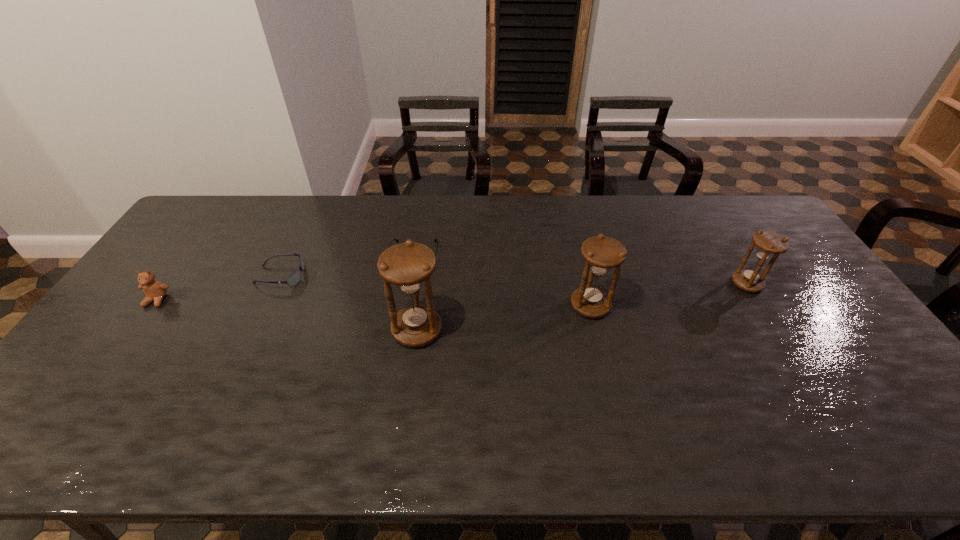
Identify the location of blank space at the far right corner. (769, 230).

The height and width of the screenshot is (540, 960). Find the location of `free spot at the near right corner of the desktop`. free spot at the near right corner of the desktop is located at coordinates (898, 395).

The width and height of the screenshot is (960, 540). Find the location of `vacant area between the leftmost hourglass and the third shortest object`. vacant area between the leftmost hourglass and the third shortest object is located at coordinates (287, 315).

Identify the location of free space that is in between the spectacles and the third shortest object. (285, 278).

The image size is (960, 540). I want to click on empty location between the second tallest hourglass and the shortest hourglass, so click(668, 295).

Locate an element on the screen. Image resolution: width=960 pixels, height=540 pixels. vacant area that lies between the second object from left to right and the rightmost object is located at coordinates (514, 280).

I want to click on free space between the second tallest hourglass and the sunglasses, so click(435, 291).

Locate an element on the screen. The height and width of the screenshot is (540, 960). free point between the leftmost hourglass and the second tallest object is located at coordinates (504, 318).

In order to click on free space between the rightmost hourglass and the shortest object in this screenshot , I will do `click(581, 269)`.

This screenshot has width=960, height=540. I want to click on empty space between the sunglasses and the rightmost hourglass, so point(514,280).